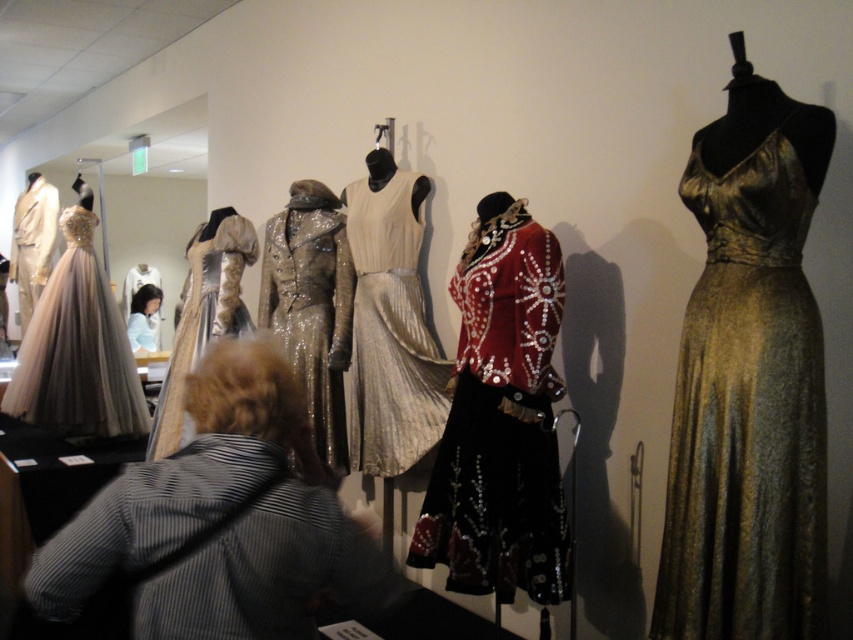
You are a photographer at the fashion exhibit and want to capture both the striped fabric shirt at lower left and the satin dress at center in a single frame. Based on their positions, which object should you ensure is placed on the left side of your camera viewfinder to include both?

The striped fabric shirt at lower left is positioned on the left side of the satin dress at center, so to include both in the frame, you should ensure the striped fabric shirt at lower left is on the left side of the viewfinder.

You are a photographer standing at the entrance of the exhibit. You want to capture a photo that includes both the gold satin dress at right and the silvery metallic dress at center. Given that your camera has a maximum zoom range of 5 meters, can you fit both dresses into the frame without moving closer?

The gold satin dress at right and silvery metallic dress at center are 6.08 meters apart, which exceeds the camera maximum zoom range of 5 meters. Therefore, you cannot fit both dresses into the frame without moving closer.

You are a photographer at the fashion exhibit. You need to capture both the silvery metallic gown at center and the matte gold dress at left in a single frame. Since the camera has a limited zoom range, which garment should you move closer to ensure both are in focus?

You should move closer to the silvery metallic gown at center because it is larger and will remain in focus even when closer, allowing the matte gold dress at left to also be captured within the frame.